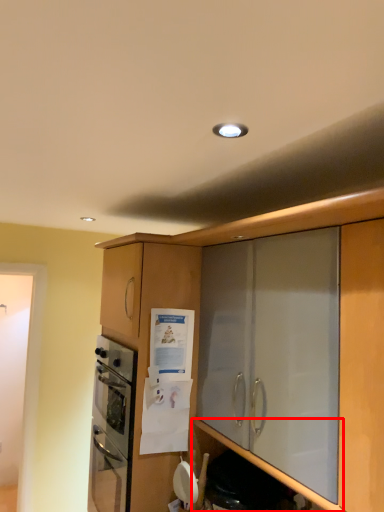
Question: From the image's perspective, where is shelf (annotated by the red box) located in relation to cabinetry in the image?

Choices:
 (A) above
 (B) below

Answer: (B)